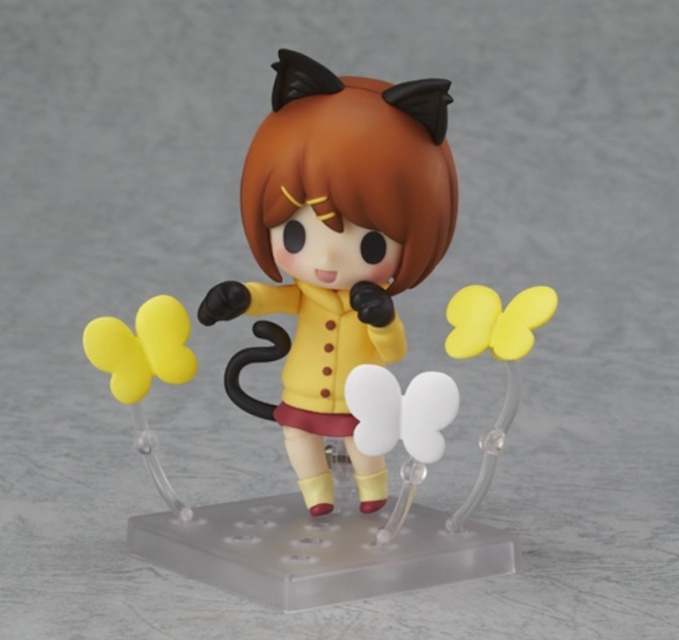
Question: Which point is closer to the camera?

Choices:
 (A) (293, 241)
 (B) (407, 205)
 (C) (90, 353)

Answer: (B)

Question: Which of the following is the closest to the observer?

Choices:
 (A) yellow matte figure at center
 (B) yellow matte balloon at left

Answer: (A)

Question: Is yellow matte figure at center below matte yellow figure at center?

Choices:
 (A) yes
 (B) no

Answer: (A)

Question: Which is nearer to the yellow matte figure at center?

Choices:
 (A) matte yellow figure at center
 (B) yellow matte balloon at left

Answer: (A)

Question: Is yellow matte figure at center positioned at the back of yellow matte balloon at left?

Choices:
 (A) yes
 (B) no

Answer: (B)

Question: From the image, what is the correct spatial relationship of matte yellow figure at center in relation to yellow matte balloon at left?

Choices:
 (A) above
 (B) below

Answer: (A)